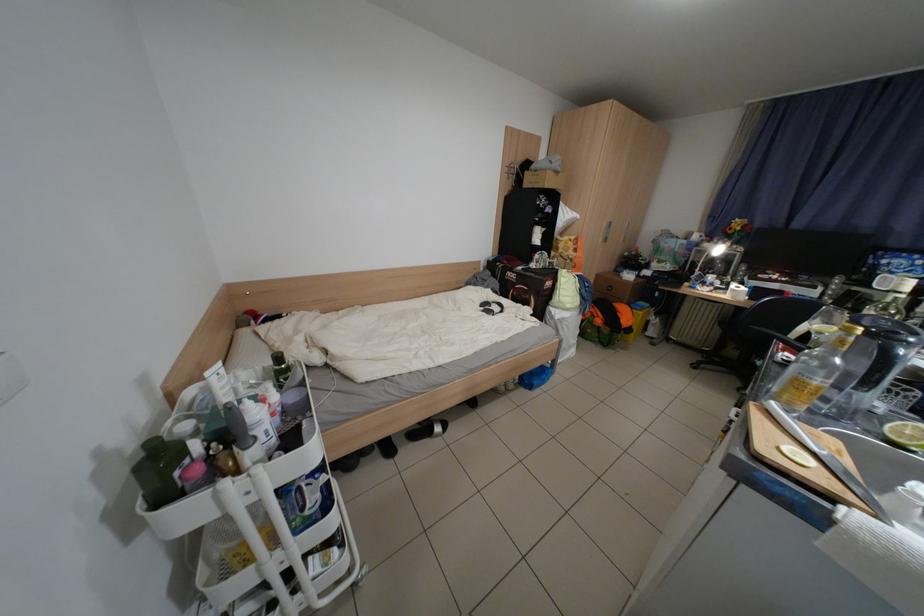
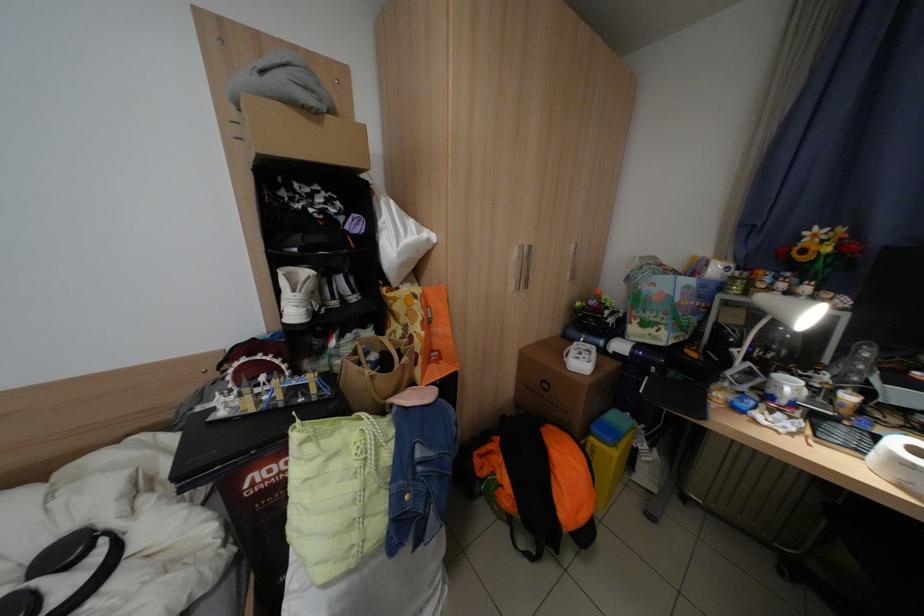
The point at (x=709, y=274) is marked in the first image. Where is the corresponding point in the second image?

(752, 366)